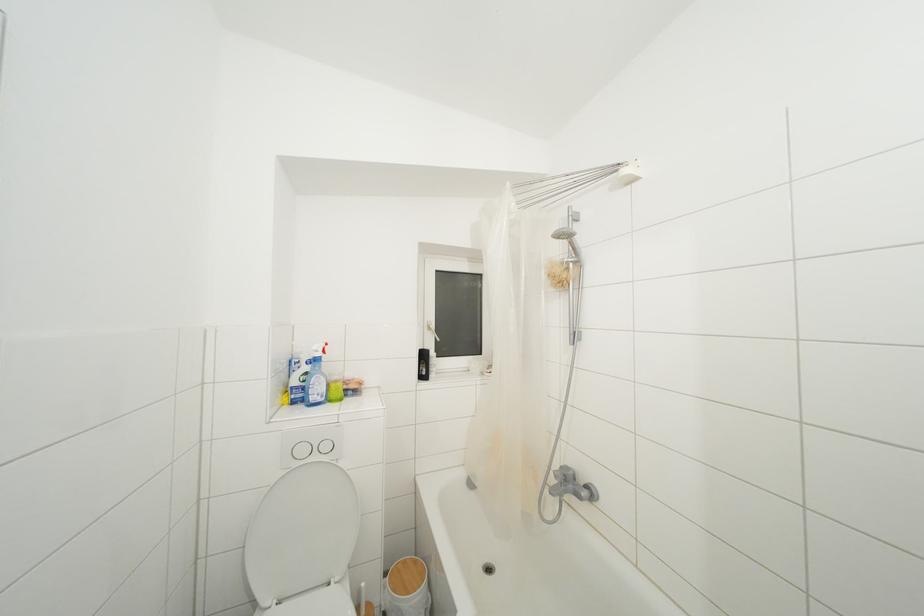
Locate an element on the screen. The image size is (924, 616). silver faucet handle is located at coordinates (565, 474).